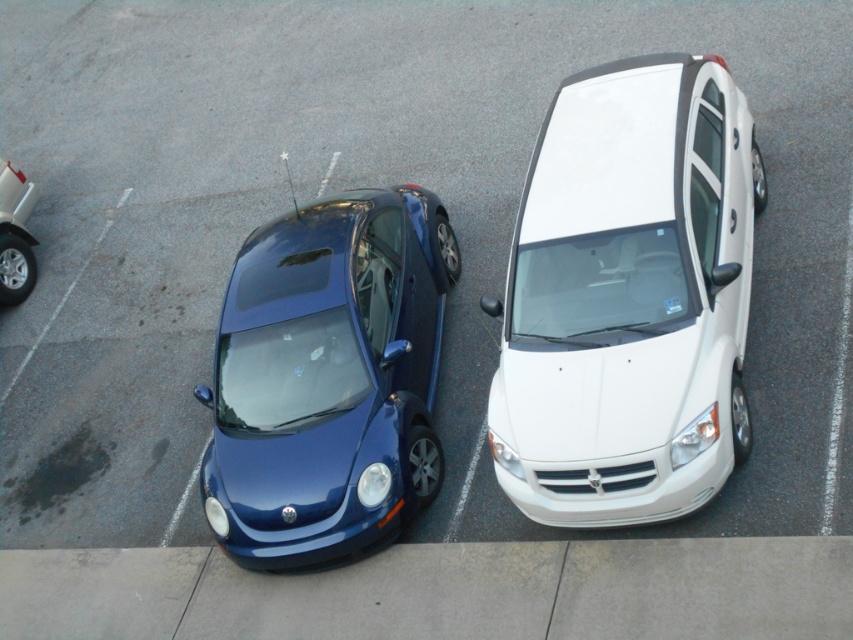
You are standing at the point labeled point (747, 161) and want to walk to the point labeled point (3, 236). Given the parking lot layout described, will you have to walk around any obstacles or can you go straight?

Since point (747, 161) is in front of point (3, 236), you can walk straight to reach the destination without needing to go around any obstacles.

You are standing in the parking lot and see two points marked in the image. Which point is closer to you, point (318, 332) or point (21, 243)?

Point (318, 332) is closer to the viewer than point (21, 243).